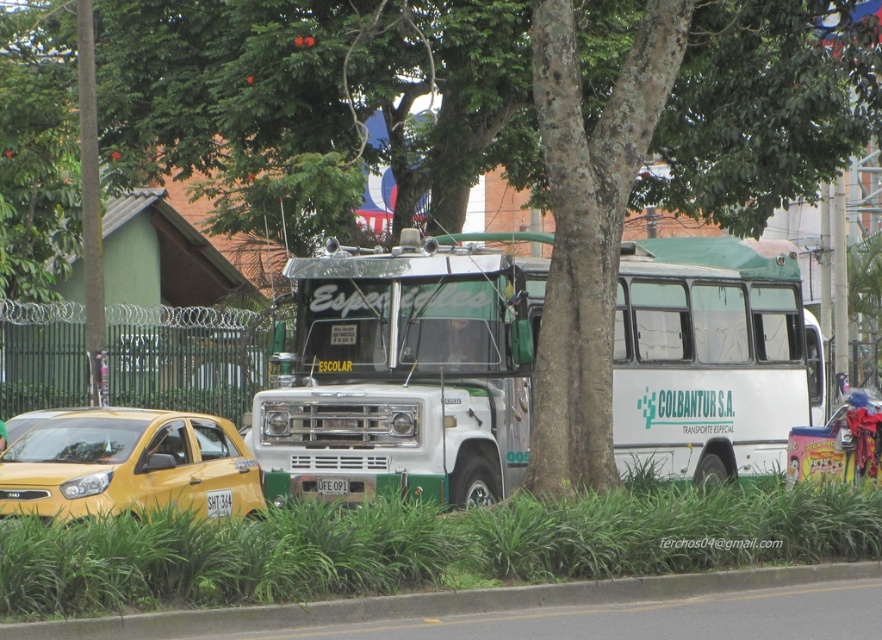
What is located at the point with coordinates (218, 502) in the image?

The white plastic license plate at center is located at point (218, 502).